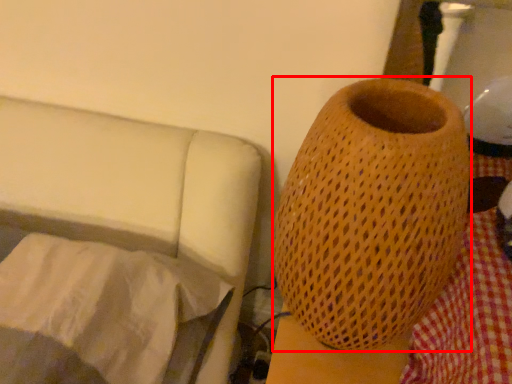
Question: Observing the image, what is the correct spatial positioning of vase (annotated by the red box) in reference to sheet?

Choices:
 (A) left
 (B) right

Answer: (B)